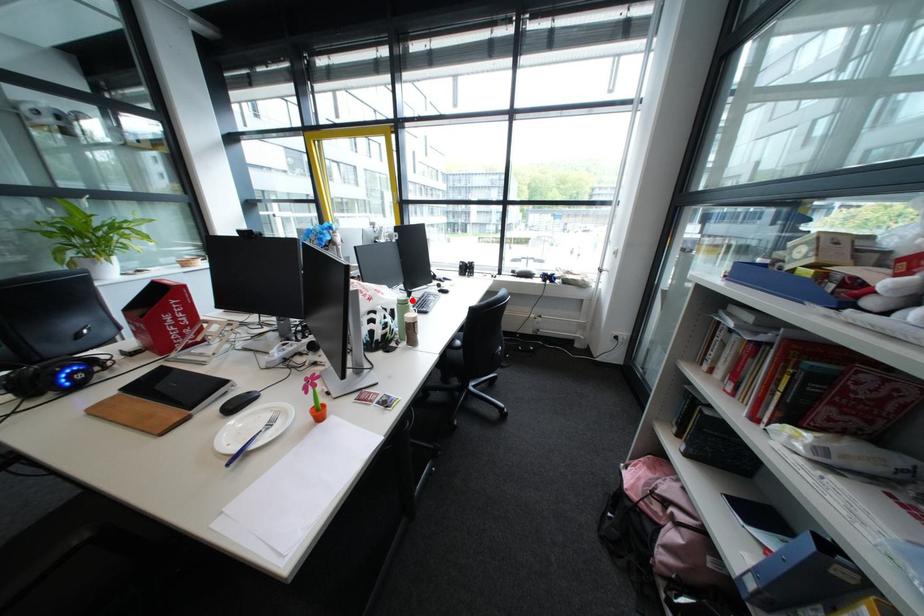
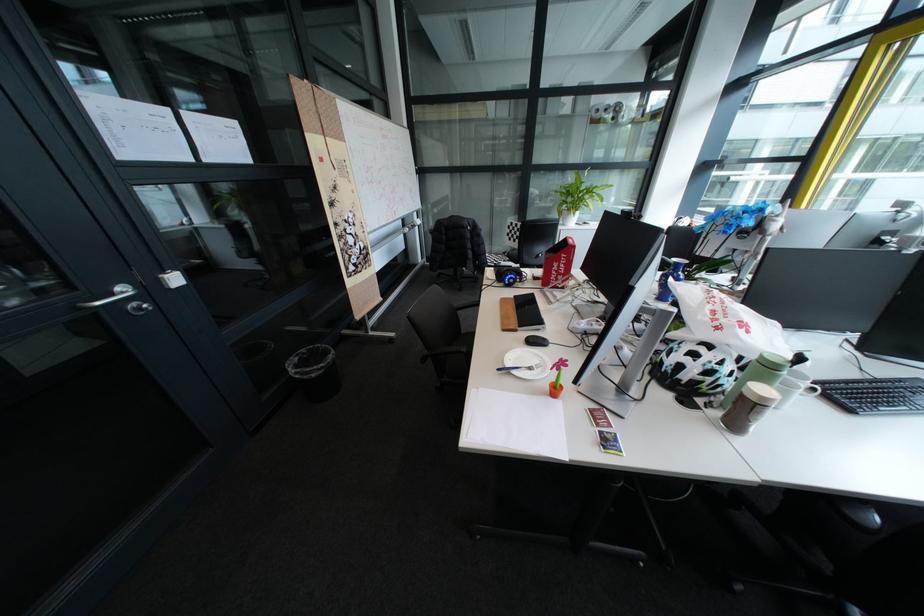
The point at the highlighted location is marked in the first image. Where is the corresponding point in the second image?

(774, 357)